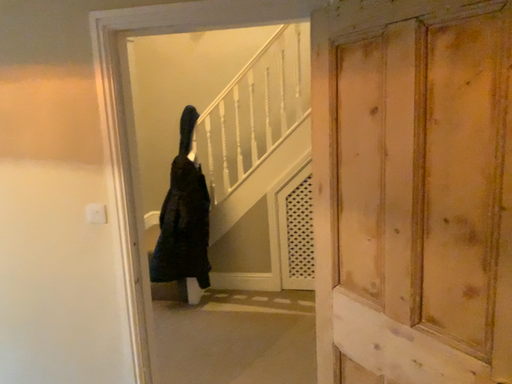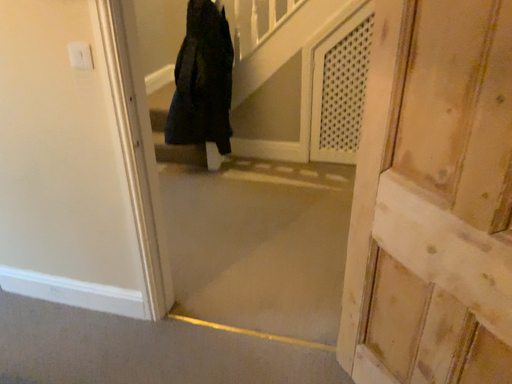
Question: Which way did the camera rotate in the video?

Choices:
 (A) rotated upward
 (B) rotated downward

Answer: (B)